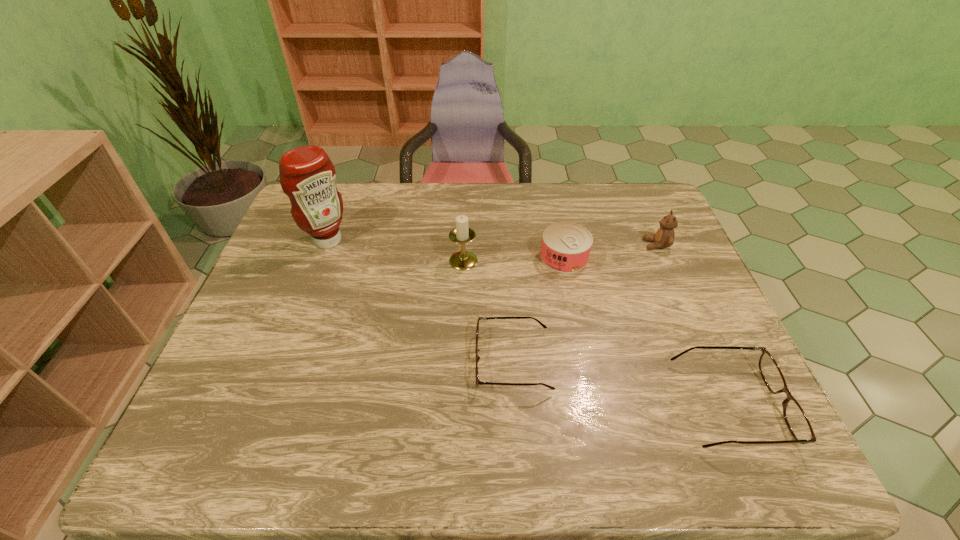
Where is `blank space located on the lenses of the shortest object`? The image size is (960, 540). blank space located on the lenses of the shortest object is located at coordinates (348, 361).

Where is `free region located 0.370m on the lenses of the shortest object`? The image size is (960, 540). free region located 0.370m on the lenses of the shortest object is located at coordinates (318, 361).

The height and width of the screenshot is (540, 960). Find the location of `free point located 0.140m on the lenses of the shortest object`. free point located 0.140m on the lenses of the shortest object is located at coordinates (416, 361).

You are a GUI agent. You are given a task and a screenshot of the screen. Output one action in this format:
    pyautogui.click(x=<x>, y=<y>)
    Task: Click on the vacant space situated 0.340m on the left of the can
    
    Given the screenshot: What is the action you would take?
    pyautogui.click(x=424, y=257)

This screenshot has width=960, height=540. I want to click on free space located 0.130m on the front-facing side of the third tallest object, so click(601, 245).

The image size is (960, 540). Identify the location of vacant space located on the front-facing side of the third tallest object. (538, 245).

Identify the location of vacant space situated on the front-facing side of the third tallest object. (535, 245).

Find the location of a particular element. vacant space located 0.150m on the right of the candle holder is located at coordinates (530, 261).

What are the coordinates of `free space located 0.290m on the right of the condiment` in the screenshot? It's located at (444, 240).

Find the location of a particular element. The height and width of the screenshot is (540, 960). object at the left edge is located at coordinates (307, 176).